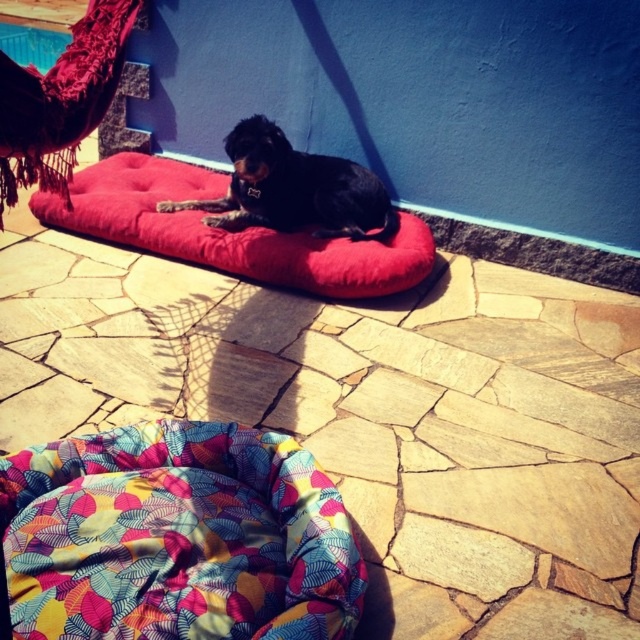
You are a delivery person who needs to place a package on the multicolored fabric bean bag at center. The package is 8 feet long. Can you safely place the package on the bean bag without it touching the black smooth dog at center?

The distance between the multicolored fabric bean bag at center and the black smooth dog at center is 7.36 feet. Since the package is 8 feet long, placing it on the bean bag would cause it to extend beyond the bean bag and potentially touch the dog. Therefore, it is not safe to place the package there.

You are a dog owner who wants to know if your black smooth dog at center can fully lie down on the velvet red dog bed at center without hanging off the edges. Based on the scene description, can it?

The velvet red dog bed at center is wider than the black smooth dog at center, so the dog can fully lie down on it without any part of its body hanging off the edges.

You are a small cat trying to jump onto the multicolored fabric bean bag at center and the velvet red dog bed at center. Which one can you reach first if you jump straight ahead?

The multicolored fabric bean bag at center is closer to the viewer than the velvet red dog bed at center, so you can reach it first by jumping straight ahead.